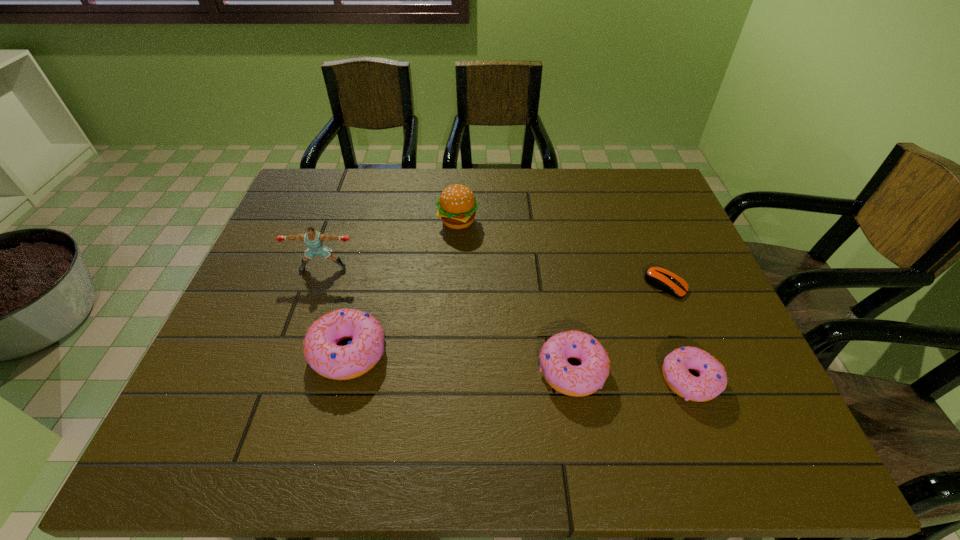
Where is `blank area located 0.050m on the back of the fourth object from left to right`? This screenshot has width=960, height=540. blank area located 0.050m on the back of the fourth object from left to right is located at coordinates (564, 324).

Where is `free space located on the back of the fifth tallest object`? The width and height of the screenshot is (960, 540). free space located on the back of the fifth tallest object is located at coordinates (660, 298).

This screenshot has width=960, height=540. What are the coordinates of `vacant space located 0.280m on the left of the computer mouse` in the screenshot? It's located at (537, 285).

Identify the location of free location located 0.360m on the front of the hamburger. (452, 336).

Locate an element on the screen. The image size is (960, 540). vacant space located on the front-facing side of the tallest object is located at coordinates (313, 300).

This screenshot has height=540, width=960. Find the location of `object that is at the far edge`. object that is at the far edge is located at coordinates (457, 205).

This screenshot has width=960, height=540. Find the location of `object positioned at the left edge`. object positioned at the left edge is located at coordinates (314, 239).

At what (x,y) coordinates should I click in order to perform the action: click on doughnut at the right edge. Please return your answer as a coordinate pair (x, y). This screenshot has width=960, height=540. Looking at the image, I should click on (712, 380).

Identify the location of computer mouse that is at the right edge. The height and width of the screenshot is (540, 960). (660, 278).

Identify the location of object situated at the near right corner. (712, 380).